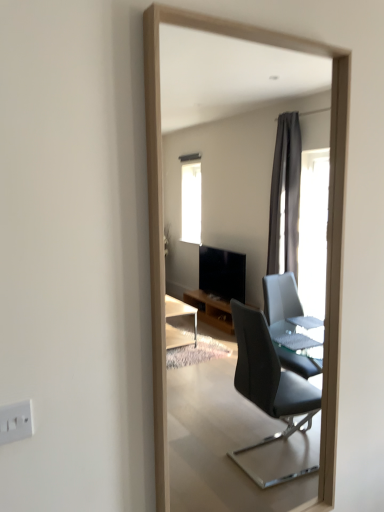
Question: From a real-world perspective, is wooden frame at center above or below white plastic electric outlet at lower left?

Choices:
 (A) below
 (B) above

Answer: (B)

Question: Is wooden frame at center in front of or behind white plastic electric outlet at lower left in the image?

Choices:
 (A) front
 (B) behind

Answer: (B)

Question: From the image's perspective, relative to white plastic electric outlet at lower left, is wooden frame at center above or below?

Choices:
 (A) below
 (B) above

Answer: (B)

Question: Is white plastic electric outlet at lower left in front of or behind wooden frame at center in the image?

Choices:
 (A) front
 (B) behind

Answer: (A)

Question: Would you say white plastic electric outlet at lower left is inside or outside wooden frame at center?

Choices:
 (A) inside
 (B) outside

Answer: (B)

Question: In terms of size, does white plastic electric outlet at lower left appear bigger or smaller than wooden frame at center?

Choices:
 (A) big
 (B) small

Answer: (B)

Question: From their relative heights in the image, would you say white plastic electric outlet at lower left is taller or shorter than wooden frame at center?

Choices:
 (A) tall
 (B) short

Answer: (B)